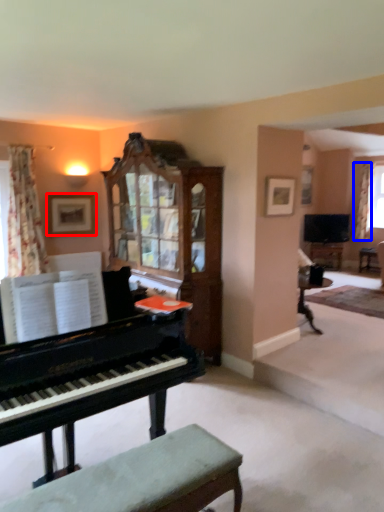
Question: Which object appears farthest to the camera in this image, picture frame (highlighted by a red box) or curtain (highlighted by a blue box)?

Choices:
 (A) picture frame
 (B) curtain

Answer: (B)